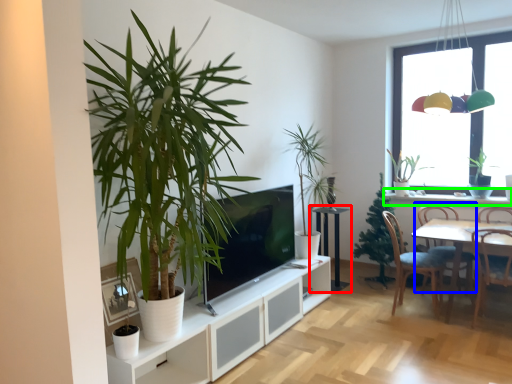
Question: Based on their relative distances, which object is farther from table (highlighted by a red box)? Choose from chair (highlighted by a blue box) and window sill (highlighted by a green box).

Choices:
 (A) chair
 (B) window sill

Answer: (B)